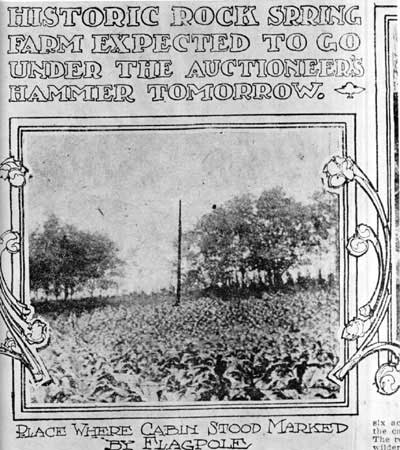
Locate an element on the screen. This screenshot has height=450, width=400. fancy border is located at coordinates (13, 321), (368, 249).